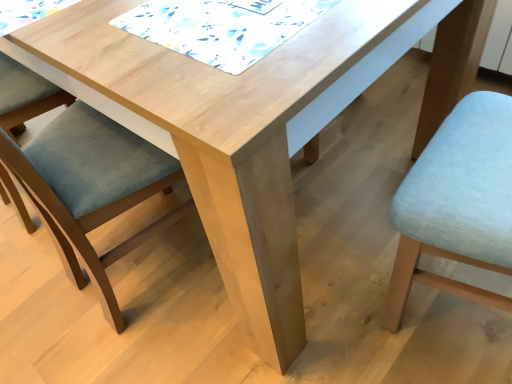
This screenshot has width=512, height=384. What do you see at coordinates (457, 203) in the screenshot?
I see `light blue fabric chair at lower right, positioned as the first chair in right-to-left order` at bounding box center [457, 203].

Find the location of a particular element. Image resolution: width=512 pixels, height=384 pixels. light blue fabric chair at lower right, arranged as the second chair when viewed from the left is located at coordinates (457, 203).

What do you see at coordinates (221, 27) in the screenshot? This screenshot has width=512, height=384. I see `white printed fabric at upper center` at bounding box center [221, 27].

Locate an element on the screen. light blue fabric chair at lower right, positioned as the first chair in right-to-left order is located at coordinates (457, 203).

Is white printed fabric at upper center in contact with matte blue cushion at left, arranged as the first chair when viewed from the left?

No, white printed fabric at upper center is not with matte blue cushion at left, arranged as the first chair when viewed from the left.

Relative to matte blue cushion at left, arranged as the first chair when viewed from the left, is white printed fabric at upper center in front or behind?

Visually, white printed fabric at upper center is located behind matte blue cushion at left, arranged as the first chair when viewed from the left.

Looking at this image, considering the relative positions of white printed fabric at upper center and matte blue cushion at left, arranged as the second chair when viewed from the right, in the image provided, is white printed fabric at upper center to the left of matte blue cushion at left, arranged as the second chair when viewed from the right, from the viewer's perspective?

No, white printed fabric at upper center is not to the left of matte blue cushion at left, arranged as the second chair when viewed from the right.

From a real-world perspective, which object stands above the other?

In real-world perspective, white printed fabric at upper center is above.

From the image's perspective, is light blue fabric chair at lower right, positioned as the first chair in right-to-left order, on top of matte blue cushion at left, arranged as the second chair when viewed from the right?

No, from the image's perspective, light blue fabric chair at lower right, positioned as the first chair in right-to-left order, is not on top of matte blue cushion at left, arranged as the second chair when viewed from the right.

Is light blue fabric chair at lower right, positioned as the first chair in right-to-left order, facing towards matte blue cushion at left, arranged as the first chair when viewed from the left?

No, light blue fabric chair at lower right, positioned as the first chair in right-to-left order, is not oriented towards matte blue cushion at left, arranged as the first chair when viewed from the left.

Based on their positions, is light blue fabric chair at lower right, positioned as the first chair in right-to-left order, located to the left or right of matte blue cushion at left, arranged as the second chair when viewed from the right?

In the image, light blue fabric chair at lower right, positioned as the first chair in right-to-left order, appears on the right side of matte blue cushion at left, arranged as the second chair when viewed from the right.

This screenshot has height=384, width=512. Identify the location of chair to the left of light blue fabric chair at lower right, positioned as the first chair in right-to-left order. (91, 187).

Which object is positioned more to the left, matte blue cushion at left, arranged as the first chair when viewed from the left, or light blue fabric chair at lower right, positioned as the first chair in right-to-left order?

Positioned to the left is matte blue cushion at left, arranged as the first chair when viewed from the left.

Which of these two, matte blue cushion at left, arranged as the first chair when viewed from the left, or light blue fabric chair at lower right, arranged as the second chair when viewed from the left, is smaller?

light blue fabric chair at lower right, arranged as the second chair when viewed from the left, is smaller.

From a real-world perspective, does matte blue cushion at left, arranged as the first chair when viewed from the left, stand above light blue fabric chair at lower right, positioned as the first chair in right-to-left order?

No, from a real-world perspective, matte blue cushion at left, arranged as the first chair when viewed from the left, is not above light blue fabric chair at lower right, positioned as the first chair in right-to-left order.

Considering the relative sizes of light blue fabric chair at lower right, positioned as the first chair in right-to-left order, and white printed fabric at upper center in the image provided, is light blue fabric chair at lower right, positioned as the first chair in right-to-left order, wider than white printed fabric at upper center?

No, light blue fabric chair at lower right, positioned as the first chair in right-to-left order, is not wider than white printed fabric at upper center.

Consider the image. Are light blue fabric chair at lower right, arranged as the second chair when viewed from the left, and white printed fabric at upper center far apart?

That's not correct — light blue fabric chair at lower right, arranged as the second chair when viewed from the left, is a little close to white printed fabric at upper center.

Is point (484, 293) less distant than point (271, 48)?

That is False.

From a real-world perspective, which is physically above, light blue fabric chair at lower right, positioned as the first chair in right-to-left order, or white printed fabric at upper center?

white printed fabric at upper center is physically above.

Considering the positions of objects matte blue cushion at left, arranged as the second chair when viewed from the right, and white printed fabric at upper center in the image provided, who is behind, matte blue cushion at left, arranged as the second chair when viewed from the right, or white printed fabric at upper center?

white printed fabric at upper center.

Is matte blue cushion at left, arranged as the second chair when viewed from the right, touching white printed fabric at upper center?

No, matte blue cushion at left, arranged as the second chair when viewed from the right, is not beside white printed fabric at upper center.

Image resolution: width=512 pixels, height=384 pixels. In the image, there is a matte blue cushion at left, arranged as the second chair when viewed from the right. Find the location of `quilt above it (from the image's perspective)`. quilt above it (from the image's perspective) is located at coordinates (221, 27).

Is point (149, 236) in front of point (159, 38)?

No, it is behind (159, 38).

Which point is more distant from viewer, (131, 20) or (468, 297)?

Positioned behind is point (468, 297).

Are white printed fabric at upper center and light blue fabric chair at lower right, positioned as the first chair in right-to-left order, located far from each other?

No.

The height and width of the screenshot is (384, 512). What are the coordinates of `chair that is the 2nd one when counting forward from the white printed fabric at upper center` in the screenshot? It's located at [x=457, y=203].

This screenshot has width=512, height=384. Find the location of `chair that is the 1st object located in front of the white printed fabric at upper center`. chair that is the 1st object located in front of the white printed fabric at upper center is located at coordinates (91, 187).

At what (x,y) coordinates should I click in order to perform the action: click on chair that is below the matte blue cushion at left, arranged as the second chair when viewed from the right (from the image's perspective). Please return your answer as a coordinate pair (x, y). This screenshot has height=384, width=512. Looking at the image, I should click on (457, 203).

Based on their spatial positions, is matte blue cushion at left, arranged as the first chair when viewed from the left, or light blue fabric chair at lower right, positioned as the first chair in right-to-left order, further from white printed fabric at upper center?

Based on the image, light blue fabric chair at lower right, positioned as the first chair in right-to-left order, appears to be further to white printed fabric at upper center.

Based on their spatial positions, is white printed fabric at upper center or matte blue cushion at left, arranged as the second chair when viewed from the right, closer to light blue fabric chair at lower right, arranged as the second chair when viewed from the left?

white printed fabric at upper center lies closer to light blue fabric chair at lower right, arranged as the second chair when viewed from the left, than the other object.

From the picture: Which object lies further to the anchor point light blue fabric chair at lower right, arranged as the second chair when viewed from the left, matte blue cushion at left, arranged as the first chair when viewed from the left, or white printed fabric at upper center?

The object further to light blue fabric chair at lower right, arranged as the second chair when viewed from the left, is matte blue cushion at left, arranged as the first chair when viewed from the left.

Estimate the real-world distances between objects in this image. Which object is closer to matte blue cushion at left, arranged as the second chair when viewed from the right, light blue fabric chair at lower right, positioned as the first chair in right-to-left order, or white printed fabric at upper center?

white printed fabric at upper center is closer to matte blue cushion at left, arranged as the second chair when viewed from the right.

Based on their spatial positions, is white printed fabric at upper center or light blue fabric chair at lower right, positioned as the first chair in right-to-left order, further from matte blue cushion at left, arranged as the first chair when viewed from the left?

Based on the image, light blue fabric chair at lower right, positioned as the first chair in right-to-left order, appears to be further to matte blue cushion at left, arranged as the first chair when viewed from the left.

Based on their spatial positions, is light blue fabric chair at lower right, arranged as the second chair when viewed from the left, or matte blue cushion at left, arranged as the second chair when viewed from the right, closer to white printed fabric at upper center?

matte blue cushion at left, arranged as the second chair when viewed from the right, is positioned closer to the anchor white printed fabric at upper center.

The height and width of the screenshot is (384, 512). I want to click on quilt situated between matte blue cushion at left, arranged as the second chair when viewed from the right, and light blue fabric chair at lower right, positioned as the first chair in right-to-left order, from left to right, so click(221, 27).